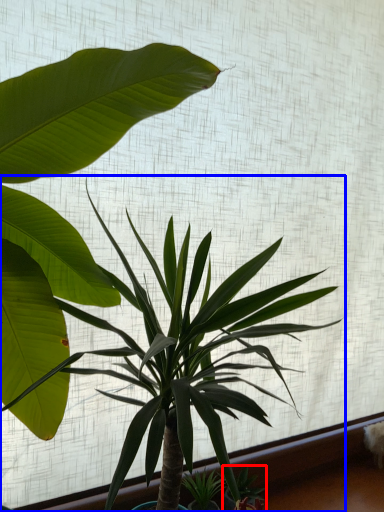
Question: Which object appears farthest to the camera in this image, plant (highlighted by a red box) or houseplant (highlighted by a blue box)?

Choices:
 (A) plant
 (B) houseplant

Answer: (A)